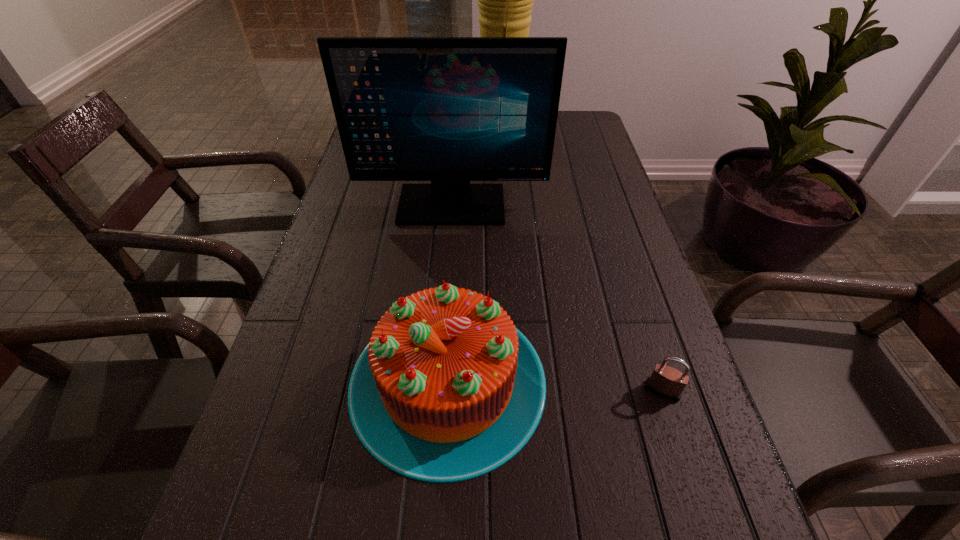
Find the location of a particular element. The width and height of the screenshot is (960, 540). unoccupied area between the cake and the tallest object is located at coordinates (474, 256).

The width and height of the screenshot is (960, 540). What are the coordinates of `free space between the tallest object and the padlock` in the screenshot? It's located at (582, 261).

Where is `free spot between the rightmost object and the tallest object`? The image size is (960, 540). free spot between the rightmost object and the tallest object is located at coordinates (582, 261).

Locate an element on the screen. vacant space that's between the trophy cup and the rightmost object is located at coordinates (582, 261).

What are the coordinates of `the second closest object to the tallest object` in the screenshot? It's located at (448, 389).

Locate an element on the screen. The height and width of the screenshot is (540, 960). object that ranks as the closest to the cake is located at coordinates (666, 382).

Locate an element on the screen. This screenshot has width=960, height=540. free spot that satisfies the following two spatial constraints: 1. at the front of the farthest object with handles; 2. on the screen side of the third shortest object is located at coordinates (506, 205).

This screenshot has width=960, height=540. Identify the location of free region that satisfies the following two spatial constraints: 1. at the front of the farthest object with handles; 2. on the screen side of the third shortest object. (506, 205).

Locate an element on the screen. The image size is (960, 540). vacant space that satisfies the following two spatial constraints: 1. on the screen side of the shortest object; 2. on the left side of the third nearest object is located at coordinates (x=438, y=390).

Image resolution: width=960 pixels, height=540 pixels. What are the coordinates of `free space that satisfies the following two spatial constraints: 1. on the screen side of the monitor; 2. on the left side of the third tallest object` in the screenshot? It's located at (439, 381).